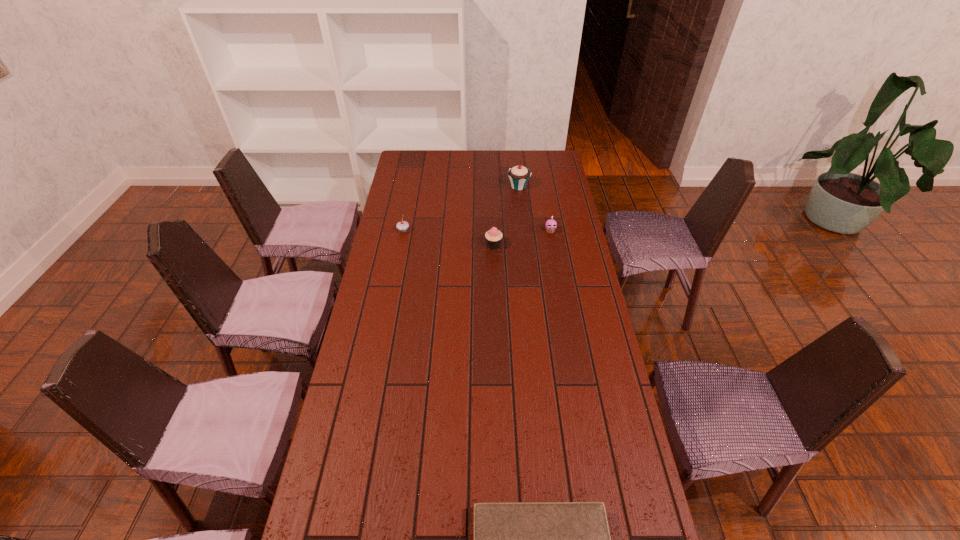
Where is `empty location between the tallest object and the rightmost cupcake`? Image resolution: width=960 pixels, height=540 pixels. empty location between the tallest object and the rightmost cupcake is located at coordinates (535, 209).

Locate an element on the screen. The height and width of the screenshot is (540, 960). unoccupied area between the third cupcake from right to left and the leftmost object is located at coordinates (448, 238).

Identify which object is located as the second nearest to the nearest object. Please provide its 2D coordinates. Your answer should be formatted as a tuple, i.e. [(x, y)], where the tuple contains the x and y coordinates of a point satisfying the conditions above.

[(551, 224)]

At what (x,y) coordinates should I click in order to perform the action: click on the closest object to the shortest object. Please return your answer as a coordinate pair (x, y). Looking at the image, I should click on [493, 237].

Identify the location of cupcake that is the third closest to the second cupcake from left to right. This screenshot has height=540, width=960. (519, 175).

Locate an element on the screen. cupcake object that ranks as the second closest to the rightmost cupcake is located at coordinates (519, 175).

Where is `free space in the image that satisfies the following two spatial constraints: 1. on the back side of the third cupcake from left to right; 2. on the right side of the leftmost cupcake`? Image resolution: width=960 pixels, height=540 pixels. free space in the image that satisfies the following two spatial constraints: 1. on the back side of the third cupcake from left to right; 2. on the right side of the leftmost cupcake is located at coordinates (412, 187).